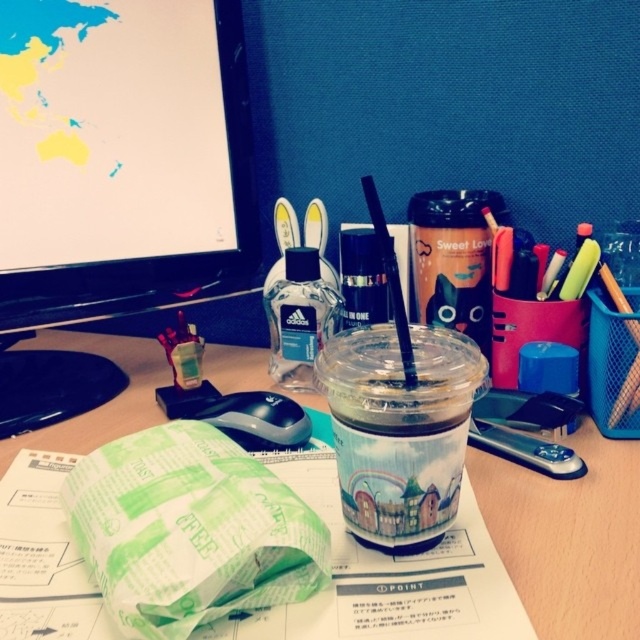
You are organizing your desk and want to place a new item between the matte black canister at center and the translucent plastic bottle at center. Which object should you place the item closer to if you want it to be near the larger object?

You should place the new item closer to the matte black canister at center because it is larger than the translucent plastic bottle at center.

You need to place a 10 cm wide paperweight on your desk. You have two options, the matte black canister at center and the black plastic mouse at lower center. Which object can accommodate the paperweight without it overlapping?

The black plastic mouse at lower center has a greater width than the matte black canister at center, so placing the 10 cm wide paperweight on the black plastic mouse at lower center would be more suitable as it provides enough space to prevent overlapping.

You are organizing your desk and want to place a new item between the matte black canister at center and the black plastic mouse at lower center. Based on their positions, where should you place the new item?

The matte black canister at center is above the black plastic mouse at lower center, so you should place the new item between them either above or below the mouse, but below the canister to maintain the vertical arrangement.